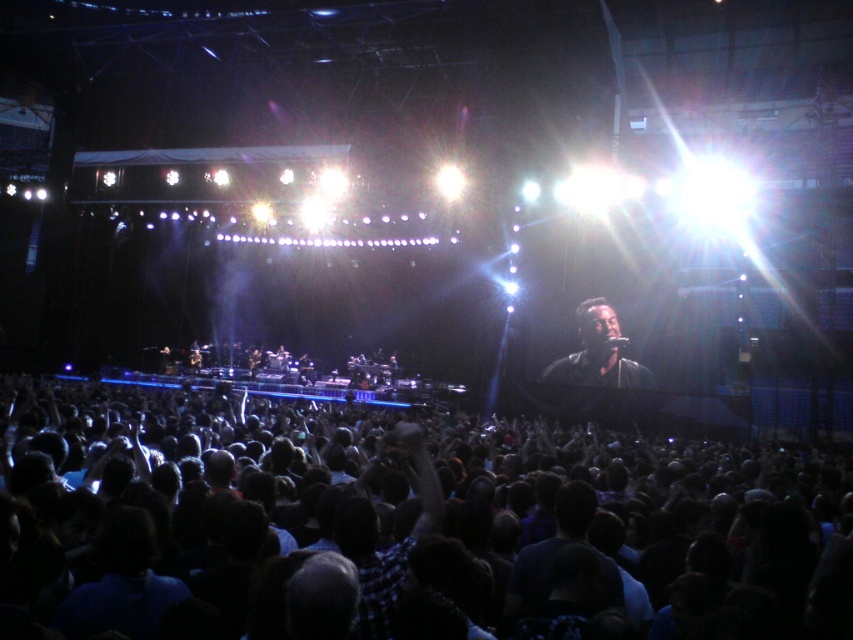
You are a photographer standing at the origin point of the coordinate system. You want to capture the dark hair crowd at center in your photo. What are the coordinates where you should aim your camera?

The dark hair crowd at center is located at coordinates point (436, 529), so you should aim your camera at those coordinates to capture them.

You are a photographer at the concert. You want to take a photo that includes both the dark hair crowd at center and the black matte microphone at center. Which object will appear bigger in the photo?

The dark hair crowd at center will appear bigger in the photo because it is larger in size than the black matte microphone at center.

You are a performer standing on stage holding the black matte microphone at center. You want to throw the microphone into the crowd. The crowd is dark hair crowd at center. Can you reach them with a throw of 10 meters?

Answer: The distance between dark hair crowd at center and black matte microphone at center is 10.33 meters. Since the throw can only reach 10 meters, the performer cannot reach them.